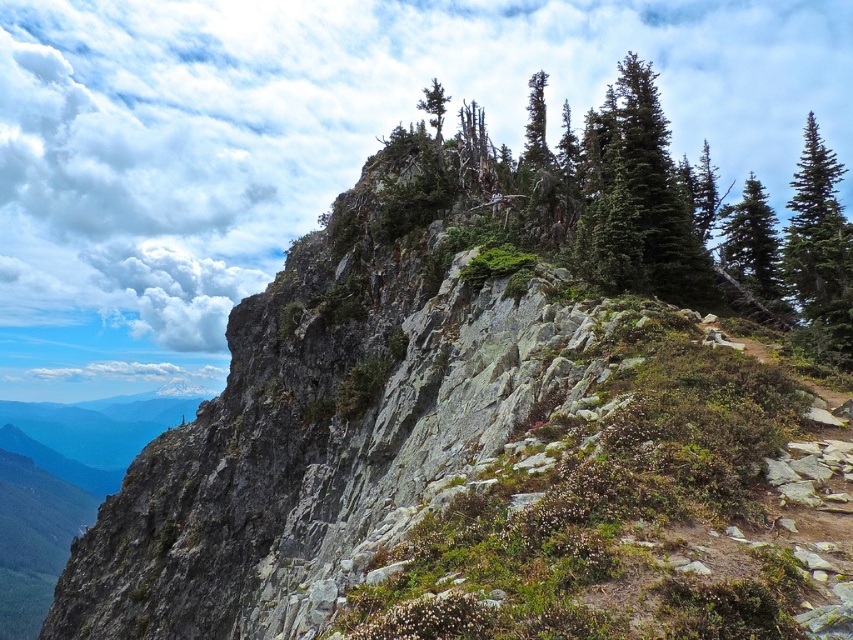
Question: Which of the following is the closest to the observer?

Choices:
 (A) green textured pine tree at upper right
 (B) green textured rock at upper center

Answer: (B)

Question: Which of the following is the closest to the observer?

Choices:
 (A) (763, 230)
 (B) (442, 99)
 (C) (618, 102)
 (D) (799, 246)

Answer: (D)

Question: Considering the relative positions of green matte tree at upper right and green matte tree at upper center in the image provided, where is green matte tree at upper right located with respect to green matte tree at upper center?

Choices:
 (A) above
 (B) below

Answer: (B)

Question: Does green textured pine tree at upper right have a greater width compared to green matte tree at upper center?

Choices:
 (A) no
 (B) yes

Answer: (B)

Question: Which object is farther from the camera taking this photo?

Choices:
 (A) green matte tree at upper center
 (B) green textured rock at upper center
 (C) green matte tree at upper right
 (D) green textured pine tree at upper right

Answer: (A)

Question: From the image, what is the correct spatial relationship of green textured rock at upper center in relation to green matte tree at upper right?

Choices:
 (A) right
 (B) left

Answer: (A)